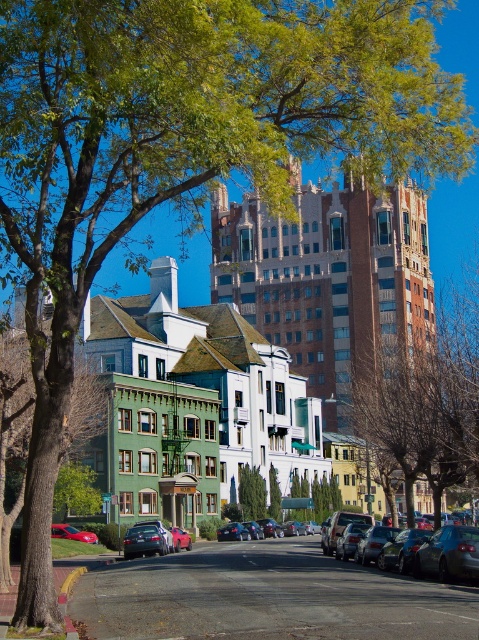
Is brown brick building at upper center bigger than shiny black sedan at center?

Indeed, brown brick building at upper center has a larger size compared to shiny black sedan at center.

Which of these two, brown brick building at upper center or shiny black sedan at center, stands shorter?

Standing shorter between the two is shiny black sedan at center.

Who is more forward, (412, 276) or (225, 540)?

Point (225, 540) is in front.

Identify the location of brown brick building at upper center. (328, 276).

Is point (440, 541) more distant than point (69, 538)?

No, it is not.

The image size is (479, 640). In order to click on blue metallic car at center in this screenshot , I will do `click(448, 554)`.

Can you confirm if shiny red car at lower left is positioned to the right of shiny black sedan at center?

Incorrect, shiny red car at lower left is not on the right side of shiny black sedan at center.

Is shiny red car at lower left above shiny black sedan at center?

Correct, shiny red car at lower left is located above shiny black sedan at center.

The height and width of the screenshot is (640, 479). What are the coordinates of `shiny red car at lower left` in the screenshot? It's located at (71, 532).